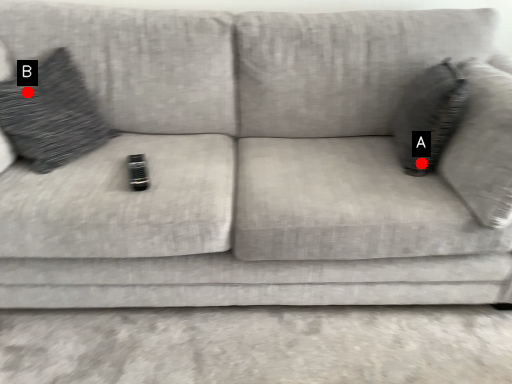
Question: Two points are circled on the image, labeled by A and B beside each circle. Which point is further to the camera?

Choices:
 (A) A is further
 (B) B is further

Answer: (A)